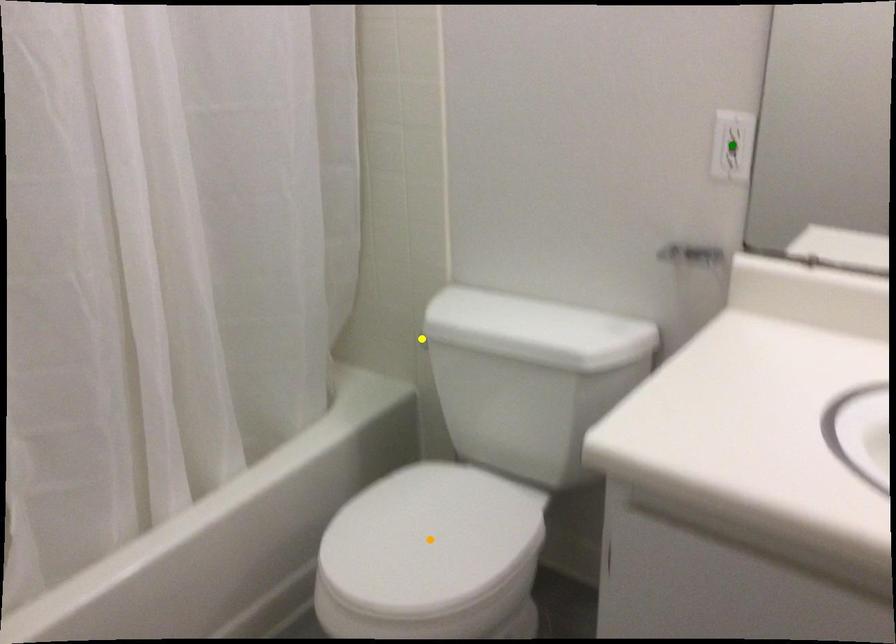
Order these from nearest to farthest:
A) yellow point
B) green point
C) orange point

green point → orange point → yellow point